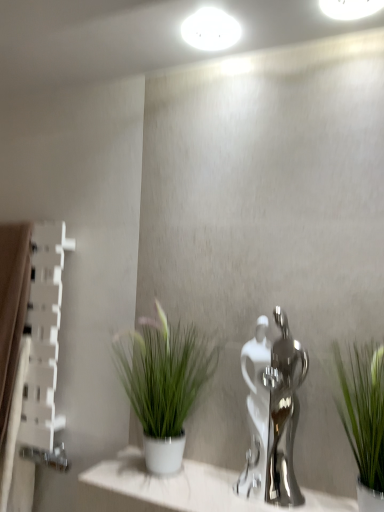
At what (x,y) coordinates should I click in order to perform the action: click on free space above white glossy ledge at center (from a real-world perspective). Please return your answer as a coordinate pair (x, y). The image size is (384, 512). Looking at the image, I should click on (216, 486).